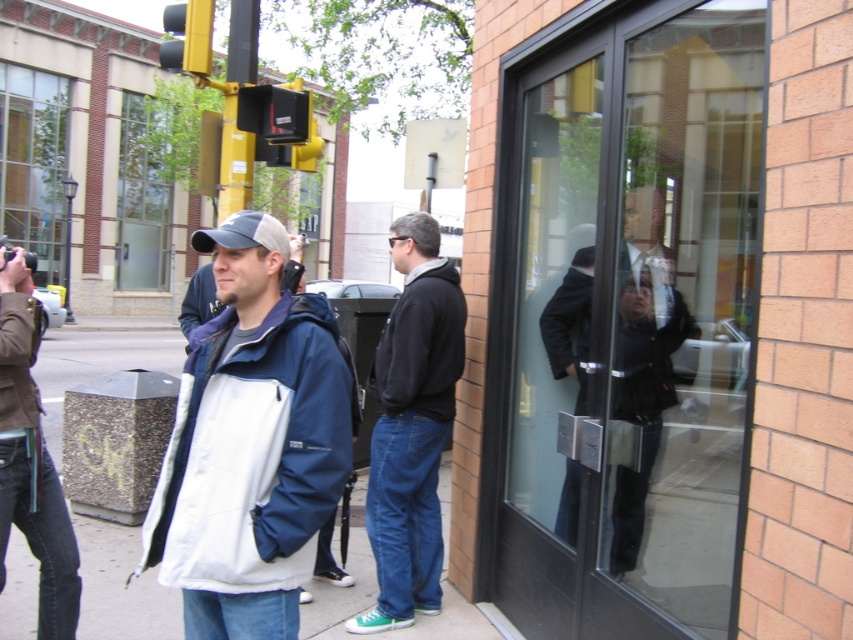
You are standing in the street scene and want to take a photo of both the point at coordinates point (666, 250) and point (33, 397). Which point should you focus on first to ensure both are in clear view?

You should focus on point (666, 250) first because it is closer to the camera than point (33, 397), so adjusting focus from near to far will help both points be in clear view.

You are a delivery person trying to walk from the transparent glass door at center to the white fabric pavement at center. Can you walk directly between them?

The transparent glass door at center is closer to the viewer than the white fabric pavement at center, so you can walk directly between them since the pavement is behind the door.